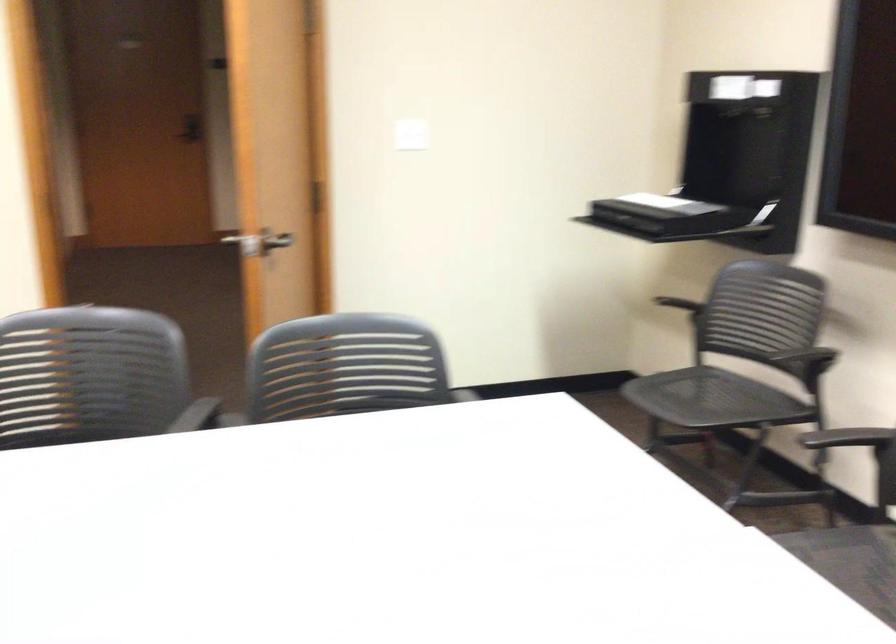
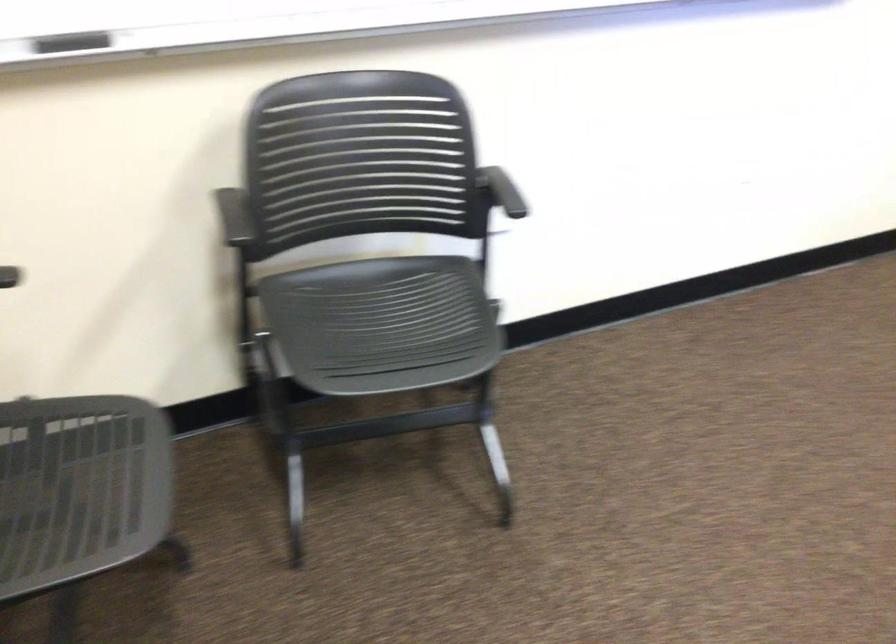
Question: The images are taken continuously from a first-person perspective. In which direction are you moving?

Choices:
 (A) Left
 (B) Right
 (C) Forward
 (D) Backward

Answer: (A)